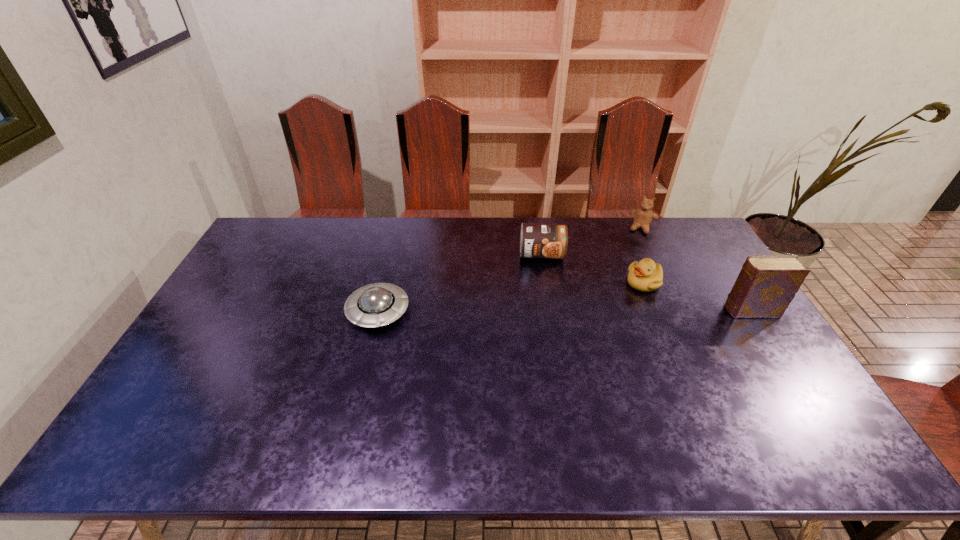
The height and width of the screenshot is (540, 960). In order to click on vacant space at the far left corner of the desktop in this screenshot , I will do `click(295, 241)`.

This screenshot has height=540, width=960. I want to click on blank space at the near right corner, so click(783, 399).

Locate an element on the screen. The width and height of the screenshot is (960, 540). free area in between the duckling and the rightmost object is located at coordinates click(x=697, y=297).

Locate an element on the screen. This screenshot has height=540, width=960. vacant space that is in between the duckling and the diary is located at coordinates (697, 297).

Where is `free space between the teddy bear and the diary`? This screenshot has width=960, height=540. free space between the teddy bear and the diary is located at coordinates (696, 269).

The height and width of the screenshot is (540, 960). What are the coordinates of `vacant area that lies between the tallest object and the teddy bear` in the screenshot? It's located at (696, 269).

Locate an element on the screen. The width and height of the screenshot is (960, 540). blank region between the duckling and the tallest object is located at coordinates (697, 297).

The image size is (960, 540). I want to click on free space between the farthest object and the duckling, so click(643, 255).

At what (x,y) coordinates should I click in order to perform the action: click on free space between the rightmost object and the duckling. Please return your answer as a coordinate pair (x, y). Looking at the image, I should click on (697, 297).

Locate an element on the screen. unoccupied position between the fourth object from right to left and the leftmost object is located at coordinates (460, 283).